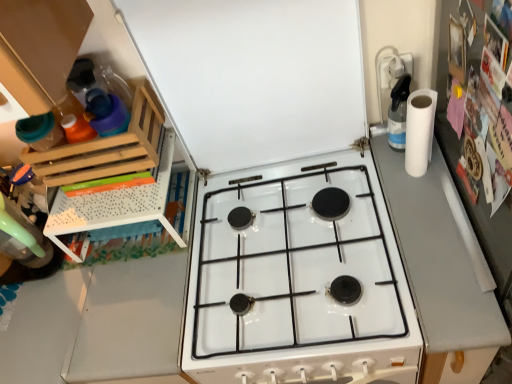
Where is `vacant space in front of white matte paper towel at right`? Image resolution: width=512 pixels, height=384 pixels. vacant space in front of white matte paper towel at right is located at coordinates (426, 213).